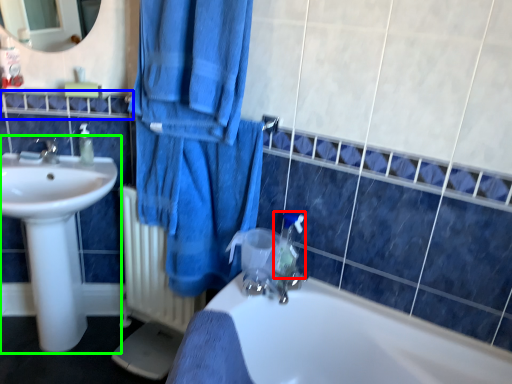
Question: Estimate the real-world distances between objects in this image. Which object is closer to plumbing fixture (highlighted by a red box), balustrade (highlighted by a blue box) or sink (highlighted by a green box)?

Choices:
 (A) balustrade
 (B) sink

Answer: (B)